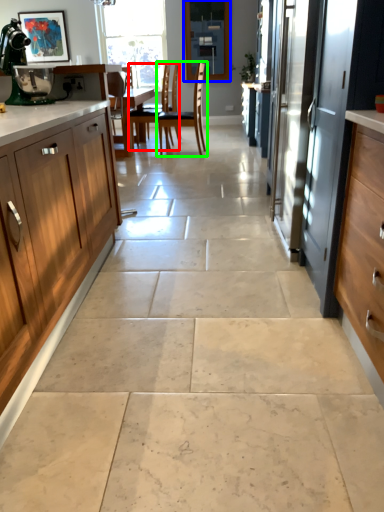
Question: Which is farther away from chair (highlighted by a red box)? window screen (highlighted by a blue box) or chair (highlighted by a green box)?

Choices:
 (A) window screen
 (B) chair

Answer: (A)